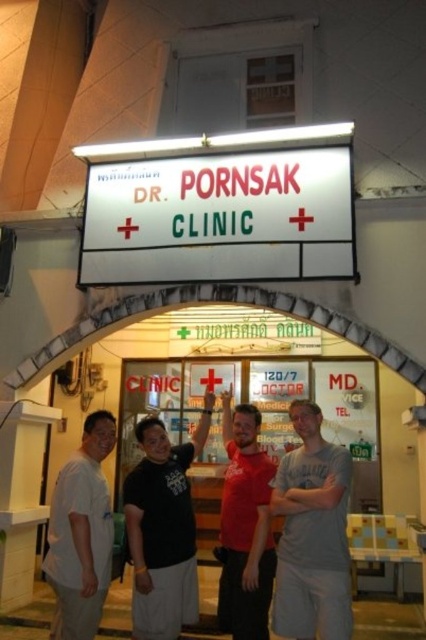
Can you confirm if white plastic sign at center is taller than black cotton shirt at center?

No, white plastic sign at center is not taller than black cotton shirt at center.

Is point (239, 163) farther from viewer compared to point (135, 518)?

Yes.

Identify the location of white plastic sign at center. The image size is (426, 640). (219, 218).

Which is more to the left, white matte shirt at left or red matte shirt at center?

Positioned to the left is white matte shirt at left.

Can you confirm if white matte shirt at left is positioned to the right of red matte shirt at center?

No, white matte shirt at left is not to the right of red matte shirt at center.

This screenshot has height=640, width=426. In order to click on white matte shirt at left in this screenshot , I will do `click(81, 532)`.

Who is higher up, white plastic sign at center or gray cotton t-shirt at center?

white plastic sign at center is above.

Locate an element on the screen. Image resolution: width=426 pixels, height=640 pixels. white plastic sign at center is located at coordinates (219, 218).